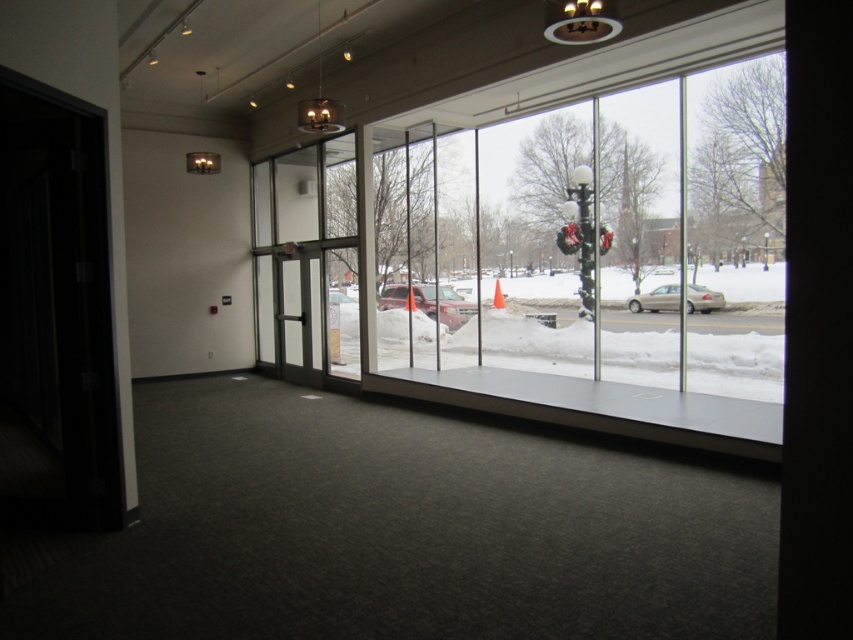
What do you see at coordinates (610, 230) in the screenshot? I see `transparent glass window at center` at bounding box center [610, 230].

Consider the image. Does transparent glass window at center lie behind clear glass door at center?

No, it is not.

Is point (445, 134) positioned behind point (340, 266)?

No, (445, 134) is in front of (340, 266).

The image size is (853, 640). I want to click on transparent glass window at center, so click(x=610, y=230).

Does matte red suv at center appear over satin beige sedan at center?

Yes.

Who is positioned more to the right, matte red suv at center or satin beige sedan at center?

satin beige sedan at center

Which is in front, point (402, 291) or point (699, 289)?

Point (699, 289)

At what (x,y) coordinates should I click in order to perform the action: click on matte red suv at center. Please return your answer as a coordinate pair (x, y). Image resolution: width=853 pixels, height=640 pixels. Looking at the image, I should click on (428, 301).

Can you confirm if transparent glass window at center is smaller than satin beige sedan at center?

Actually, transparent glass window at center might be larger than satin beige sedan at center.

Is transparent glass window at center thinner than satin beige sedan at center?

No, transparent glass window at center is not thinner than satin beige sedan at center.

In order to click on transparent glass window at center in this screenshot , I will do `click(610, 230)`.